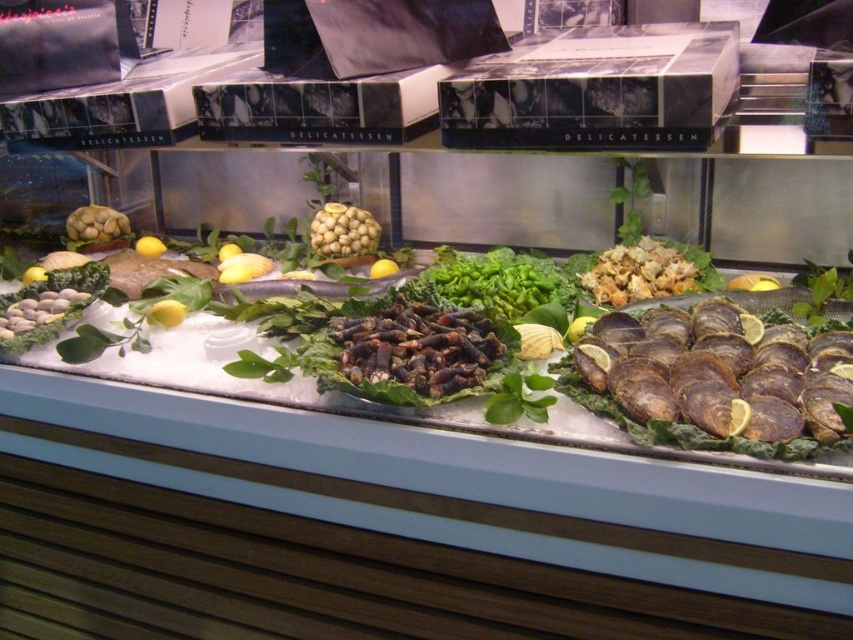
You are a customer looking at the refrigerated display case. You want to grab the brown textured oysters at center and the green leafy vegetable at center. Which one should you reach for first if you want to pick the item closer to your left side?

The green leafy vegetable at center is to the left of brown textured oysters at center, so you should reach for the green leafy vegetable at center first if you want the item closer to your left side.

You are a customer at the seafood counter and want to point out two specific points inside the refrigerated display case. The first point is at coordinates point (329, 220) and the second point is at point (99, 220). Which of these two points is closer to you?

Point (329, 220) is closer to the viewer than point (99, 220).

You are a customer at a seafood market and want to grab the smooth beige nuts at center and the green matte artichoke at left from the display case. Which item should you reach for first if you want to pick up the one that is closer to you?

The smooth beige nuts at center is in front of the green matte artichoke at left, so you should reach for the smooth beige nuts at center first as it is closer to you.